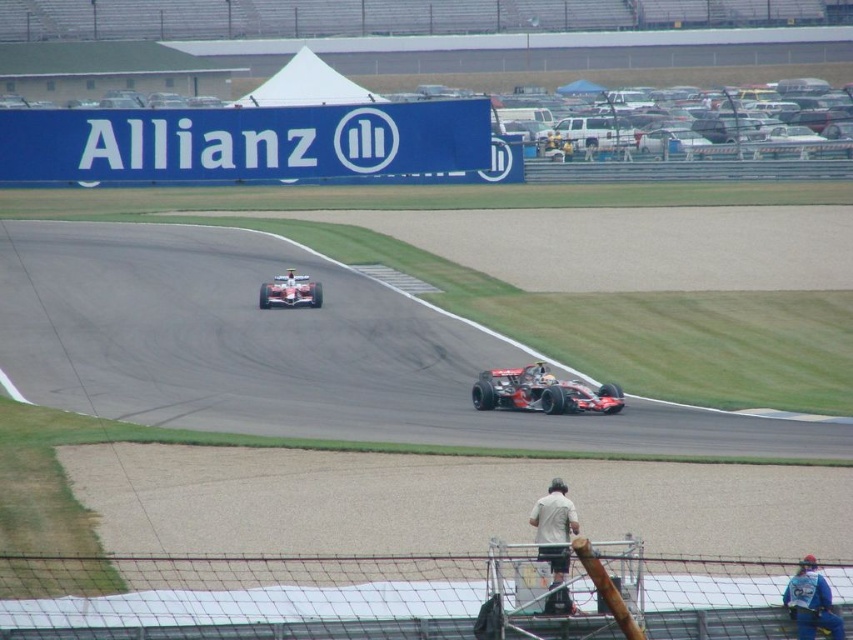
Based on the photo, can you confirm if blue denim jacket at lower right is smaller than white fabric person at center?

Correct, blue denim jacket at lower right occupies less space than white fabric person at center.

Consider the image. Between blue denim jacket at lower right and white fabric person at center, which one appears on the right side from the viewer's perspective?

Positioned to the right is white fabric person at center.

Does point (814, 612) lie behind point (566, 145)?

No, it is in front of (566, 145).

Locate an element on the screen. blue denim jacket at lower right is located at coordinates (811, 602).

Where is `shiny red race car at center`? shiny red race car at center is located at coordinates (541, 394).

Find the location of a particular element. This screenshot has width=853, height=640. shiny red race car at center is located at coordinates (541, 394).

Where is `shiny red race car at center`? The width and height of the screenshot is (853, 640). shiny red race car at center is located at coordinates (541, 394).

Who is more forward, (810, 611) or (541, 378)?

Point (810, 611) is more forward.

In the scene shown: Can you confirm if blue denim jacket at lower right is wider than shiny silver helmet at center?

Yes.

Which is behind, point (798, 604) or point (541, 369)?

Point (541, 369)

Find the location of `blue denim jacket at lower right`. blue denim jacket at lower right is located at coordinates (811, 602).